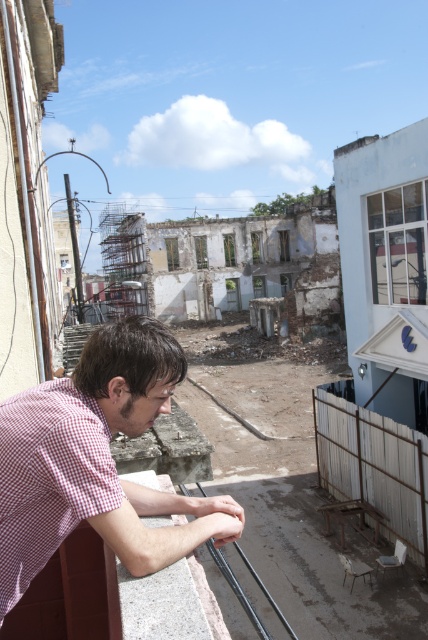
Which is more to the left, red checkered shirt at lower left or metal/smooth rail at lower center?

red checkered shirt at lower left

In the scene shown: Is red checkered shirt at lower left closer to the viewer compared to metal/smooth rail at lower center?

Yes, it is in front of metal/smooth rail at lower center.

Find the location of a particular element. The width and height of the screenshot is (428, 640). red checkered shirt at lower left is located at coordinates (95, 460).

Measure the distance between red checkered shirt at lower left and camera.

red checkered shirt at lower left is 4.57 feet away from camera.

Does point (8, 509) lie behind point (127, 624)?

Yes.

This screenshot has width=428, height=640. I want to click on red checkered shirt at lower left, so click(x=95, y=460).

Between gray concrete ledge at lower left and metal/smooth rail at lower center, which one is positioned higher?

gray concrete ledge at lower left is higher up.

Can you confirm if gray concrete ledge at lower left is wider than metal/smooth rail at lower center?

No.

This screenshot has height=640, width=428. I want to click on gray concrete ledge at lower left, so click(163, 602).